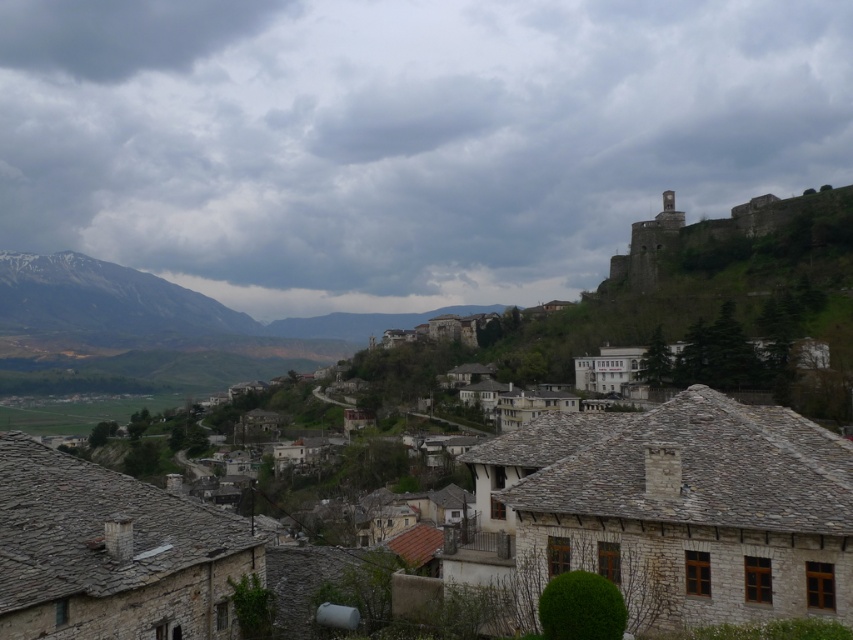
You are standing in the town square and want to take a photo. There are two points of interest marked as point 1 at coordinates (181, 3) and point 2 at (44, 40). Which point will appear larger in your photo?

Point 1 at coordinates (181, 3) will appear larger in the photo because it is closer to the camera than point 2 at (44, 40).

You are standing in the town square and looking towards the castle. Which object in the image is taller, the cloudy sky at upper center or the stone village at center?

The cloudy sky at upper center is taller than the stone village at center.